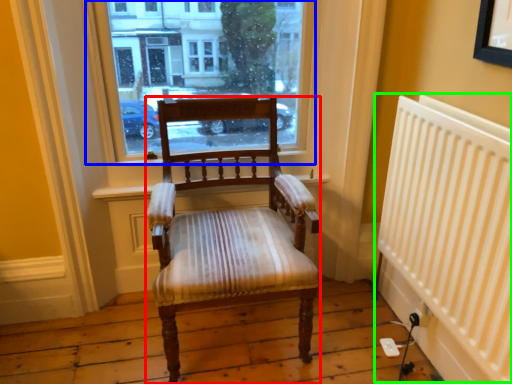
Question: Which object is positioned farthest from chair (highlighted by a red box)? Select from window (highlighted by a blue box) and radiator (highlighted by a green box).

Choices:
 (A) window
 (B) radiator

Answer: (B)